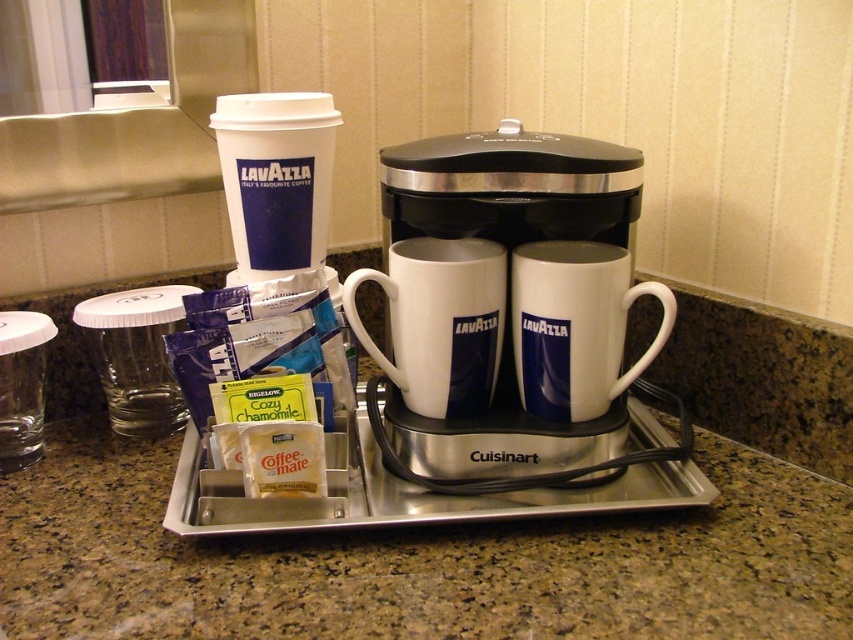
Can you confirm if white glossy ceramic coffee machine at center is bigger than white ceramic mug at center?

Indeed, white glossy ceramic coffee machine at center has a larger size compared to white ceramic mug at center.

Can you confirm if white glossy ceramic coffee machine at center is taller than white ceramic mug at center?

Correct, white glossy ceramic coffee machine at center is much taller as white ceramic mug at center.

Is point (506, 122) positioned after point (621, 378)?

Yes, point (506, 122) is farther from viewer.

Locate an element on the screen. This screenshot has height=640, width=853. white glossy ceramic coffee machine at center is located at coordinates (509, 308).

Locate an element on the screen. This screenshot has height=640, width=853. granite countertop at center is located at coordinates (461, 525).

Who is shorter, granite countertop at center or white ceramic mug at center?

Standing shorter between the two is white ceramic mug at center.

The height and width of the screenshot is (640, 853). Describe the element at coordinates (461, 525) in the screenshot. I see `granite countertop at center` at that location.

Locate an element on the screen. The width and height of the screenshot is (853, 640). granite countertop at center is located at coordinates (461, 525).

Between granite countertop at center and white glossy ceramic coffee machine at center, which one has more height?

Standing taller between the two is white glossy ceramic coffee machine at center.

Does granite countertop at center have a greater width compared to white glossy ceramic coffee machine at center?

Correct, the width of granite countertop at center exceeds that of white glossy ceramic coffee machine at center.

Between point (521, 634) and point (380, 362), which one is positioned in front?

Point (521, 634)

Where is `granite countertop at center`? granite countertop at center is located at coordinates (461, 525).